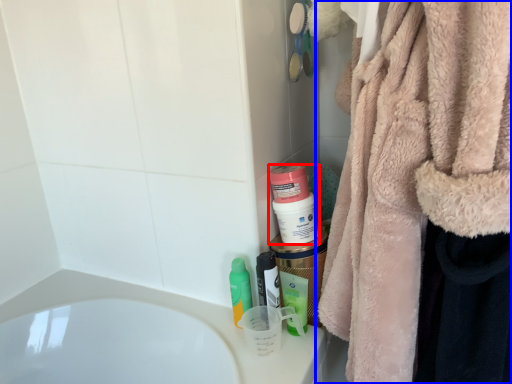
Question: Which object appears farthest to the camera in this image, mouthwash (highlighted by a red box) or towel (highlighted by a blue box)?

Choices:
 (A) mouthwash
 (B) towel

Answer: (A)